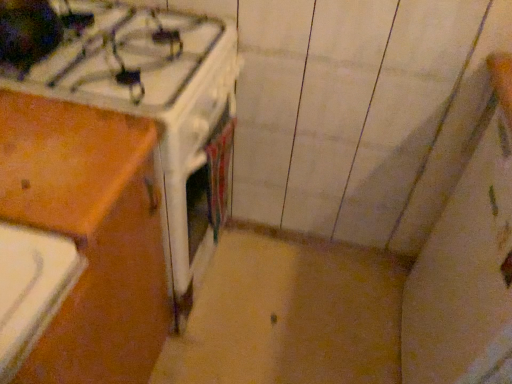
Question: Is point (36, 6) closer or farther from the camera than point (158, 190)?

Choices:
 (A) farther
 (B) closer

Answer: (B)

Question: From the image's perspective, is white glossy gas stove at upper left positioned above or below wooden at left?

Choices:
 (A) above
 (B) below

Answer: (A)

Question: Considering the positions of white glossy gas stove at upper left and wooden at left in the image, is white glossy gas stove at upper left taller or shorter than wooden at left?

Choices:
 (A) short
 (B) tall

Answer: (A)

Question: Considering their positions, is wooden at left located in front of or behind white glossy gas stove at upper left?

Choices:
 (A) front
 (B) behind

Answer: (A)

Question: Is wooden at left inside or outside of white glossy gas stove at upper left?

Choices:
 (A) inside
 (B) outside

Answer: (B)

Question: Considering the relative positions of wooden at left and white glossy gas stove at upper left in the image provided, is wooden at left to the left or to the right of white glossy gas stove at upper left?

Choices:
 (A) left
 (B) right

Answer: (A)

Question: From the image's perspective, relative to white glossy gas stove at upper left, is wooden at left above or below?

Choices:
 (A) above
 (B) below

Answer: (B)